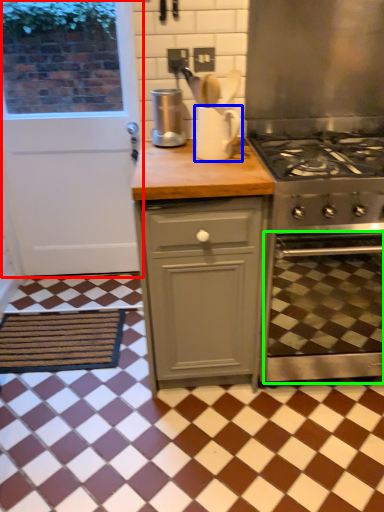
Question: Which is nearer to the door (highlighted by a red box)? appliance (highlighted by a blue box) or oven (highlighted by a green box).

Choices:
 (A) appliance
 (B) oven

Answer: (A)